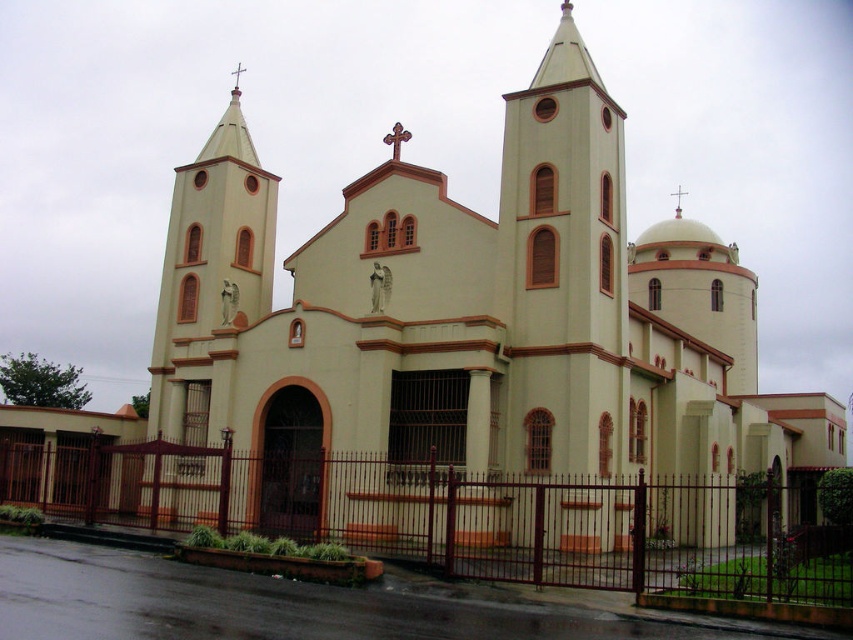
Which of these two, wooden cross at center or metallic gold cross at upper center, stands shorter?

wooden cross at center is shorter.

Does wooden cross at center lie in front of metallic gold cross at upper center?

Yes, it is in front of metallic gold cross at upper center.

I want to click on wooden cross at center, so 396,138.

Does brown metal fence at lower center come in front of wooden cross at center?

That is True.

Does brown metal fence at lower center appear on the left side of wooden cross at center?

No, brown metal fence at lower center is not to the left of wooden cross at center.

Between point (815, 490) and point (390, 141), which one is positioned in front?

Point (390, 141)

You are a GUI agent. You are given a task and a screenshot of the screen. Output one action in this format:
    pyautogui.click(x=<x>, y=<y>)
    Task: Click on the brown metal fence at lower center
    This screenshot has width=853, height=640.
    Given the screenshot: What is the action you would take?
    pyautogui.click(x=469, y=516)

Who is more distant from viewer, (578, 500) or (677, 189)?

Point (677, 189)

The height and width of the screenshot is (640, 853). Describe the element at coordinates (469, 516) in the screenshot. I see `brown metal fence at lower center` at that location.

Who is more forward, (500, 499) or (679, 216)?

Point (500, 499) is in front.

This screenshot has width=853, height=640. Identify the location of brown metal fence at lower center. (469, 516).